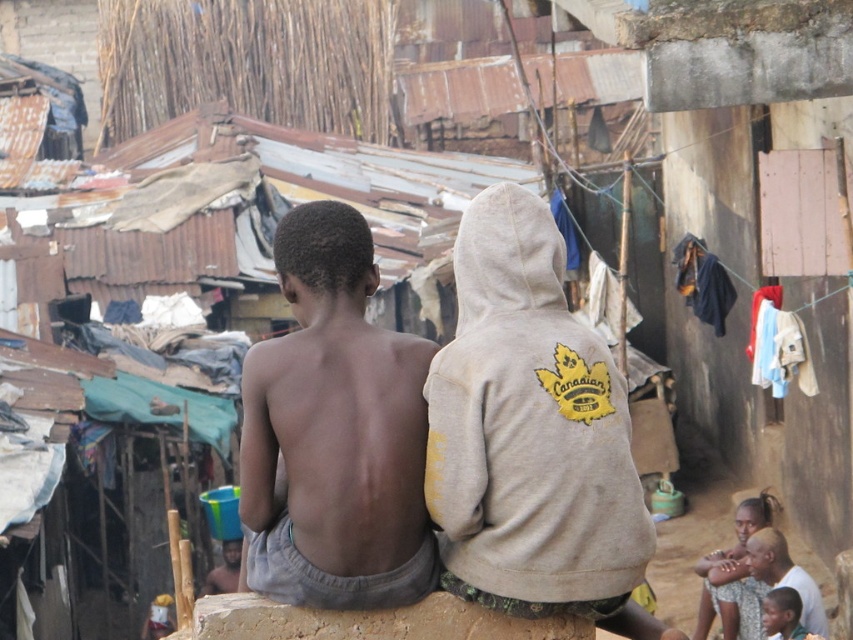
In the scene shown: You are a tailor who needs to determine if the light beige hoodie at center can fit over the light brown skin at center. Based on their widths, can the hoodie accommodate the skin?

The light beige hoodie at center has a width less than the light brown skin at center, so it may not fit properly over the skin.

You are a photographer aiming to capture the two people sitting on the wall in the image. Given that the brown rough stone at lower center and the light brown skin at center are part of the scene, which object takes up more visual area in the photo?

The light brown skin at center occupies more visual area than the brown rough stone at lower center, as the brown rough stone at lower center occupies less space than light brown skin at center.